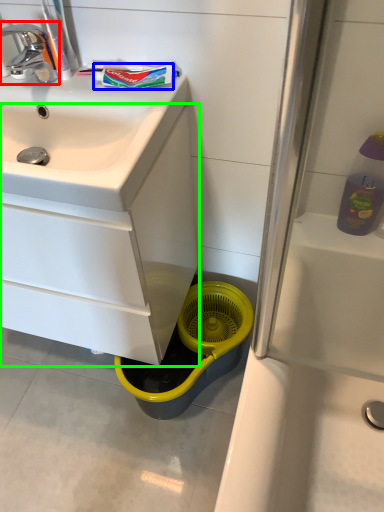
Question: Considering the real-world distances, which object is closest to tap (highlighted by a red box)? toothpaste (highlighted by a blue box) or bathroom cabinet (highlighted by a green box).

Choices:
 (A) toothpaste
 (B) bathroom cabinet

Answer: (A)